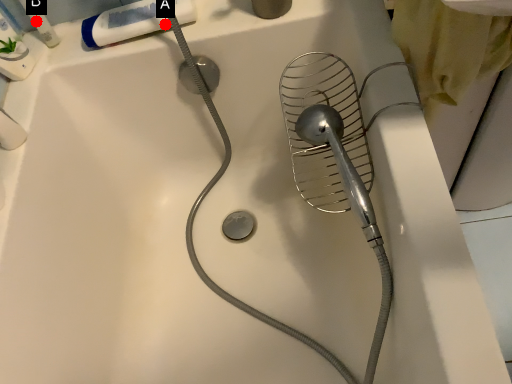
Question: Two points are circled on the image, labeled by A and B beside each circle. Among these points, which one is nearest to the camera?

Choices:
 (A) A is closer
 (B) B is closer

Answer: (A)